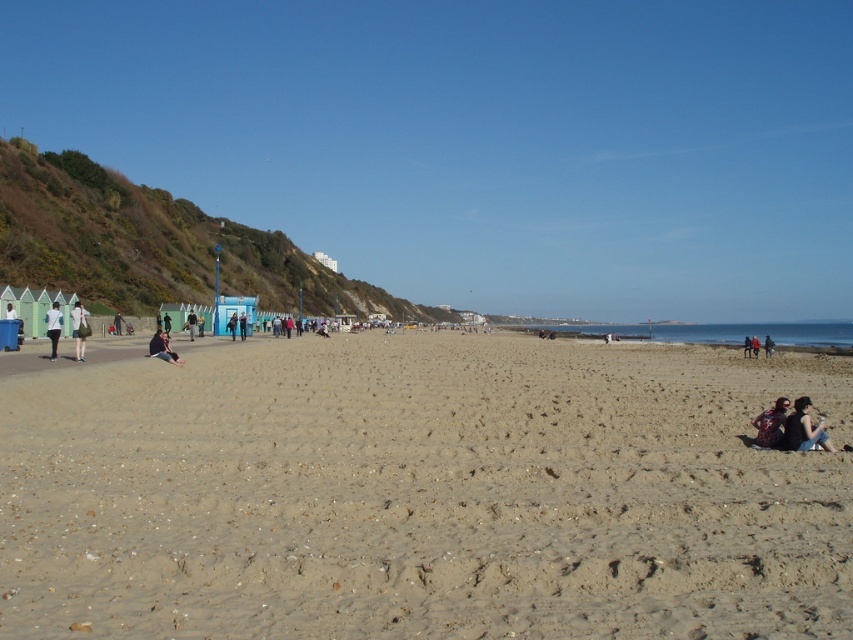
Can you confirm if green leafy hillside at left is positioned below matte black hair at lower right?

No.

Between green leafy hillside at left and matte black hair at lower right, which one is positioned higher?

green leafy hillside at left is higher up.

Is point (254, 285) positioned behind point (817, 426)?

Yes, it is.

Locate an element on the screen. Image resolution: width=853 pixels, height=640 pixels. green leafy hillside at left is located at coordinates (155, 244).

Is matte black hair at lower right wider than printed fabric dress at lower right?

Correct, the width of matte black hair at lower right exceeds that of printed fabric dress at lower right.

Is matte black hair at lower right below printed fabric dress at lower right?

Correct, matte black hair at lower right is located below printed fabric dress at lower right.

The image size is (853, 640). I want to click on matte black hair at lower right, so click(804, 429).

Locate an element on the screen. Image resolution: width=853 pixels, height=640 pixels. matte black hair at lower right is located at coordinates (804, 429).

Does matte black hair at lower right lie behind dark blue jeans at left?

No, it is not.

Locate an element on the screen. matte black hair at lower right is located at coordinates (804, 429).

At what (x,y) coordinates should I click in order to perform the action: click on matte black hair at lower right. Please return your answer as a coordinate pair (x, y). This screenshot has height=640, width=853. Looking at the image, I should click on (804, 429).